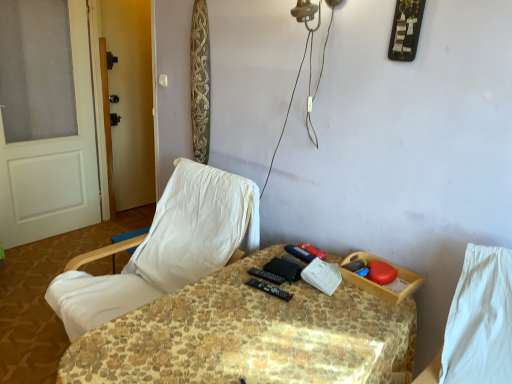
Locate an element on the screen. The image size is (512, 384). free space above patterned fabric table at center (from a real-world perspective) is located at coordinates (258, 326).